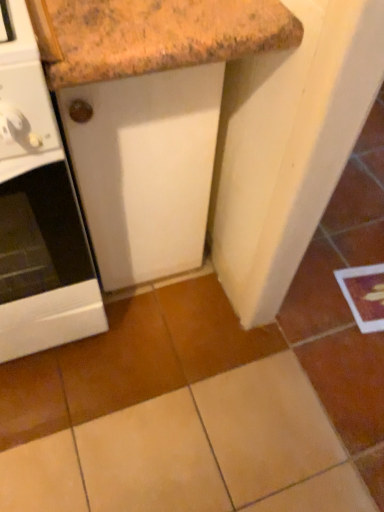
The width and height of the screenshot is (384, 512). What do you see at coordinates (38, 210) in the screenshot?
I see `white glossy oven at left` at bounding box center [38, 210].

Measure the distance between white glossy oven at left and camera.

The depth of white glossy oven at left is 19.56 inches.

Where is `white glossy oven at left`? This screenshot has height=512, width=384. white glossy oven at left is located at coordinates (38, 210).

Image resolution: width=384 pixels, height=512 pixels. In order to click on white glossy oven at left in this screenshot , I will do `click(38, 210)`.